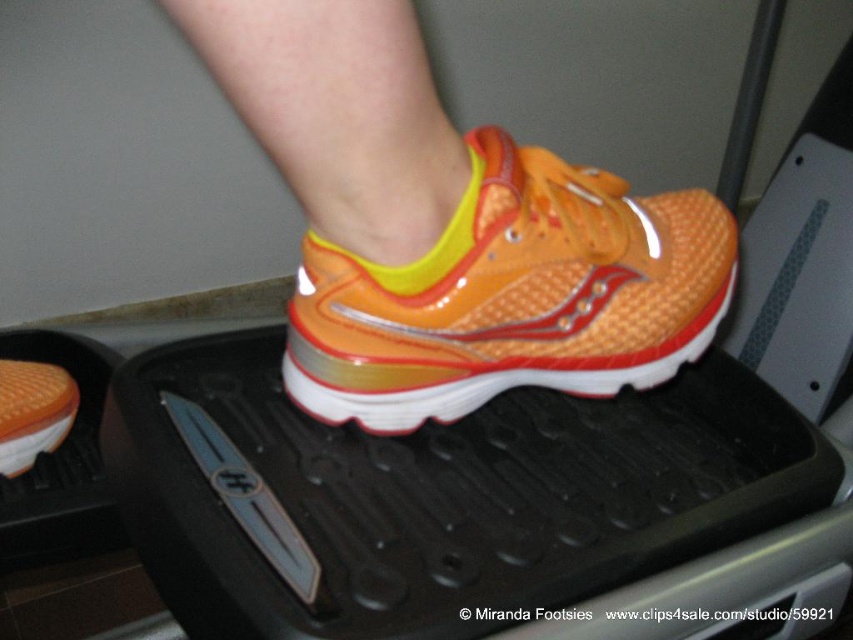
The height and width of the screenshot is (640, 853). I want to click on orange glossy running shoe at center, so click(x=512, y=296).

Does point (453, 355) lie behind point (20, 419)?

That is False.

Which is behind, point (543, 356) or point (15, 440)?

The point (15, 440) is more distant.

You are a GUI agent. You are given a task and a screenshot of the screen. Output one action in this format:
    pyautogui.click(x=<x>, y=<y>)
    Task: Click on the orange glossy running shoe at center
    
    Given the screenshot: What is the action you would take?
    pyautogui.click(x=512, y=296)